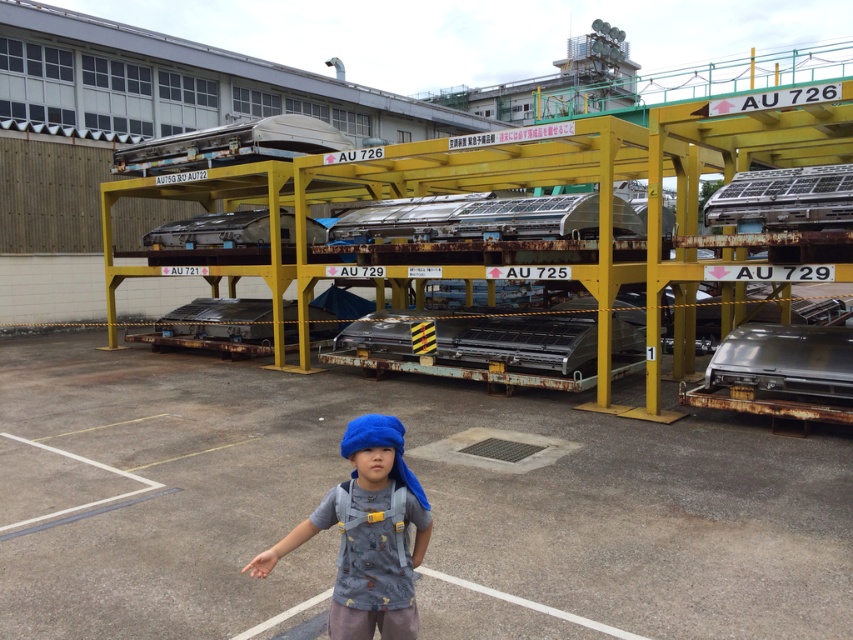
You are a maintenance worker in the industrial area. You need to place a new tool box on the gray concrete parking lot at center. Can you fit it there considering the size of the blue fabric headband at center?

The gray concrete parking lot at center is larger in size than the blue fabric headband at center, so the parking lot has enough space to accommodate the tool box.

You need to park a vehicle that is the same size as the shiny metallic car at right. Based on the scene, can the gray concrete parking lot at center accommodate this vehicle?

The gray concrete parking lot at center is wider than the shiny metallic car at right, so it can accommodate the vehicle.